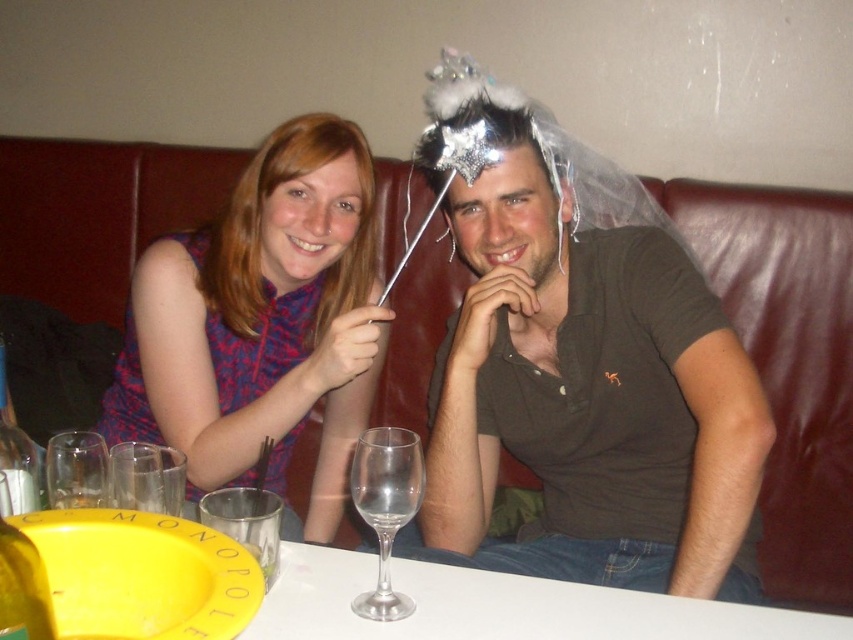
Measure the distance between matte brown shirt at center and clear glass wine glass at lower left.

25.57 inches

Measure the distance between matte brown shirt at center and camera.

3.35 feet

Locate an element on the screen. matte brown shirt at center is located at coordinates (584, 385).

Locate an element on the screen. The height and width of the screenshot is (640, 853). matte brown shirt at center is located at coordinates (584, 385).

Who is higher up, matte brown shirt at center or transparent glass wine glass at center?

matte brown shirt at center

Can you confirm if matte brown shirt at center is taller than transparent glass wine glass at center?

Yes.

Where is `matte brown shirt at center`? matte brown shirt at center is located at coordinates (584, 385).

Where is `matte brown shirt at center`? matte brown shirt at center is located at coordinates (584, 385).

Who is taller, white glossy table at center or clear glass wine glass at lower left?

With more height is white glossy table at center.

Which is more to the right, white glossy table at center or clear glass wine glass at lower left?

From the viewer's perspective, white glossy table at center appears more on the right side.

Image resolution: width=853 pixels, height=640 pixels. What are the coordinates of `white glossy table at center` in the screenshot? It's located at (341, 593).

Locate an element on the screen. This screenshot has width=853, height=640. white glossy table at center is located at coordinates (341, 593).